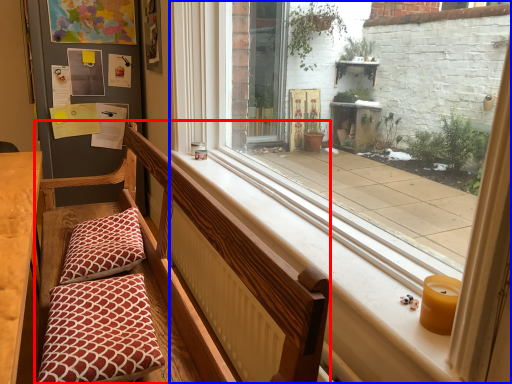
Question: Among these objects, which one is nearest to the camera, church bench (highlighted by a red box) or window (highlighted by a blue box)?

Choices:
 (A) church bench
 (B) window

Answer: (A)